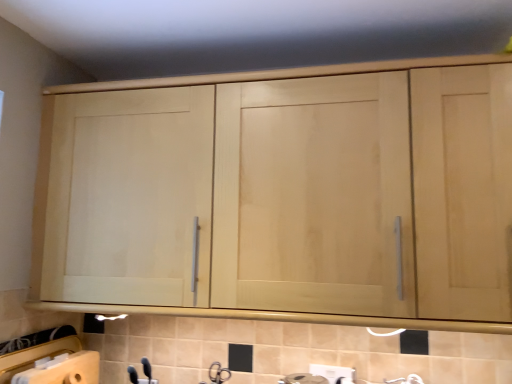
Locate an element on the screen. This screenshot has width=512, height=384. matte silver faucet at lower center is located at coordinates (218, 373).

What do you see at coordinates (218, 373) in the screenshot?
I see `matte silver faucet at lower center` at bounding box center [218, 373].

I want to click on light wood cabinet at upper center, so click(x=300, y=194).

The height and width of the screenshot is (384, 512). What do you see at coordinates (300, 194) in the screenshot? I see `light wood cabinet at upper center` at bounding box center [300, 194].

In order to face light wood cabinet at upper center, should I rotate leftwards or rightwards?

A 1.239 degree turn to the right will do.

Locate an element on the screen. The image size is (512, 384). matte silver faucet at lower center is located at coordinates (218, 373).

Considering the positions of objects matte silver faucet at lower center and light wood cabinet at upper center in the image provided, who is more to the right, matte silver faucet at lower center or light wood cabinet at upper center?

Positioned to the right is light wood cabinet at upper center.

Which object is closer to the camera taking this photo, matte silver faucet at lower center or light wood cabinet at upper center?

light wood cabinet at upper center is closer to the camera.

Is point (213, 379) positioned after point (313, 296)?

Yes.

From the image's perspective, between matte silver faucet at lower center and light wood cabinet at upper center, who is located below?

matte silver faucet at lower center.

From a real-world perspective, is matte silver faucet at lower center on light wood cabinet at upper center?

Incorrect, from a real-world perspective, matte silver faucet at lower center is lower than light wood cabinet at upper center.

Considering the relative sizes of matte silver faucet at lower center and light wood cabinet at upper center in the image provided, is matte silver faucet at lower center wider than light wood cabinet at upper center?

No.

Considering the relative sizes of matte silver faucet at lower center and light wood cabinet at upper center in the image provided, is matte silver faucet at lower center taller than light wood cabinet at upper center?

Incorrect, the height of matte silver faucet at lower center is not larger of that of light wood cabinet at upper center.

Can you confirm if matte silver faucet at lower center is smaller than light wood cabinet at upper center?

Yes.

Is matte silver faucet at lower center not within light wood cabinet at upper center?

Indeed, matte silver faucet at lower center is completely outside light wood cabinet at upper center.

Are matte silver faucet at lower center and light wood cabinet at upper center making contact?

matte silver faucet at lower center is not next to light wood cabinet at upper center, and they're not touching.

Does matte silver faucet at lower center turn towards light wood cabinet at upper center?

No.

What's the angular difference between matte silver faucet at lower center and light wood cabinet at upper center's facing directions?

They differ by 7.66 degrees in their facing directions.

Measure the distance from matte silver faucet at lower center to light wood cabinet at upper center.

matte silver faucet at lower center and light wood cabinet at upper center are 31.78 inches apart.

Locate an element on the screen. faucet behind the light wood cabinet at upper center is located at coordinates (218, 373).

Can you confirm if light wood cabinet at upper center is positioned to the right of matte silver faucet at lower center?

Indeed, light wood cabinet at upper center is positioned on the right side of matte silver faucet at lower center.

Is light wood cabinet at upper center further to camera compared to matte silver faucet at lower center?

No, light wood cabinet at upper center is closer to the camera.

Does point (106, 119) appear closer or farther from the camera than point (230, 371)?

Point (106, 119) appears to be closer to the viewer than point (230, 371).

From the image's perspective, is light wood cabinet at upper center on matte silver faucet at lower center?

Yes, from the image's perspective, light wood cabinet at upper center is above matte silver faucet at lower center.

From a real-world perspective, who is located lower, light wood cabinet at upper center or matte silver faucet at lower center?

From a 3D spatial view, matte silver faucet at lower center is below.

Based on the photo, does light wood cabinet at upper center have a lesser width compared to matte silver faucet at lower center?

Incorrect, the width of light wood cabinet at upper center is not less than that of matte silver faucet at lower center.

Considering the relative sizes of light wood cabinet at upper center and matte silver faucet at lower center in the image provided, is light wood cabinet at upper center shorter than matte silver faucet at lower center?

No.

Considering the relative sizes of light wood cabinet at upper center and matte silver faucet at lower center in the image provided, is light wood cabinet at upper center bigger than matte silver faucet at lower center?

Indeed, light wood cabinet at upper center has a larger size compared to matte silver faucet at lower center.

Can we say light wood cabinet at upper center lies outside matte silver faucet at lower center?

Absolutely, light wood cabinet at upper center is external to matte silver faucet at lower center.

Is light wood cabinet at upper center touching matte silver faucet at lower center?

No, light wood cabinet at upper center is not making contact with matte silver faucet at lower center.

Is light wood cabinet at upper center facing towards matte silver faucet at lower center?

No, light wood cabinet at upper center is not turned towards matte silver faucet at lower center.

Where is `cupboard in front of the matte silver faucet at lower center`? cupboard in front of the matte silver faucet at lower center is located at coordinates (300, 194).

At what (x,y) coordinates should I click in order to perform the action: click on faucet below the light wood cabinet at upper center (from a real-world perspective). Please return your answer as a coordinate pair (x, y). Looking at the image, I should click on (218, 373).

In the image, there is a light wood cabinet at upper center. Identify the location of faucet below it (from the image's perspective). (218, 373).